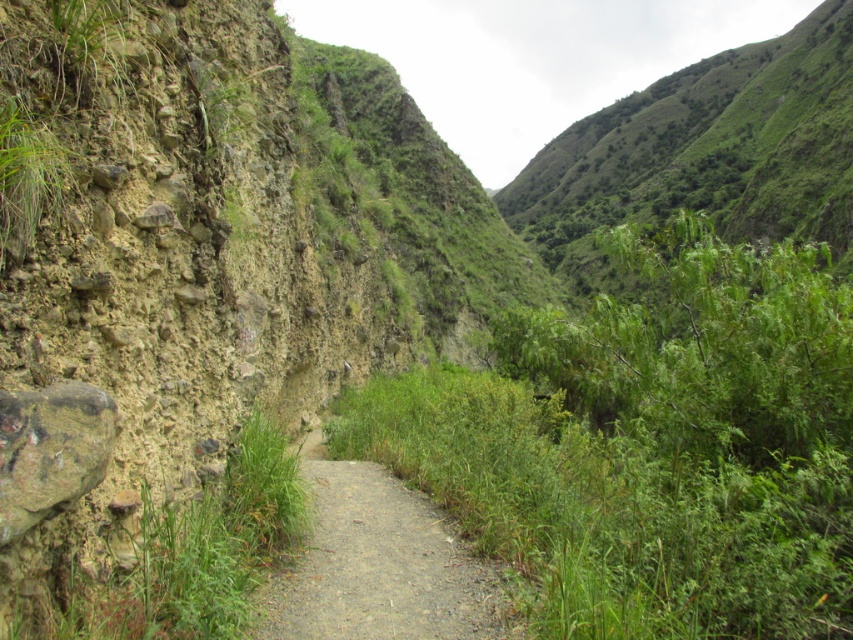
You are standing on the narrow unpaved pathway through the valley and see the point marked at coordinates (650, 445). What is located at that point?

The point at coordinates (650, 445) indicates a green leafy bush at center.

You are a hiker carrying a heavy backpack and want to rest on the gray gravel path at center. However, there is a green leafy bush at center blocking your way. Can you sit down on the path here?

The green leafy bush at center is above gray gravel path at center, so the bush is not blocking the path itself. You can sit down on the gray gravel path at center.

You are a hiker carrying a heavy backpack and want to take a break. You see the green leafy bush at center and the gray gravel path at center. Which location would be more stable to sit on?

The gray gravel path at center is more stable to sit on because the green leafy bush at center is positioned on the right side of it, meaning the path is solid ground while the bush may have unstable roots or uneven terrain.